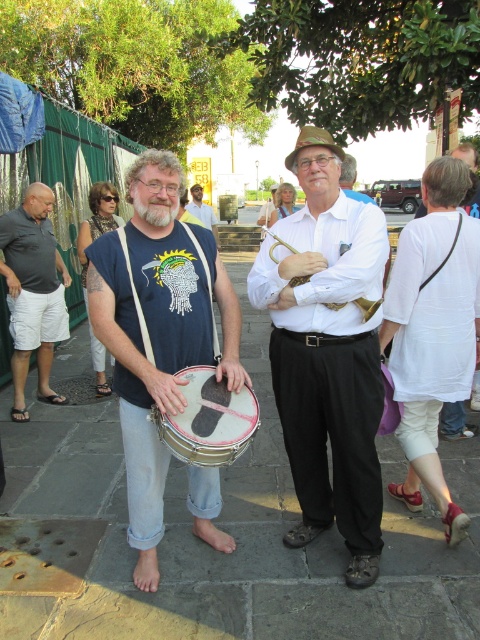
Question: Can you confirm if matte black drum at center is positioned below matte blue shirt at center?

Choices:
 (A) no
 (B) yes

Answer: (B)

Question: Which point is closer to the camera taking this photo?

Choices:
 (A) (271, 230)
 (B) (199, 392)
 (C) (250, 326)
 (D) (291, 328)

Answer: (B)

Question: Which point is closer to the camera?

Choices:
 (A) matte black t-shirt at center
 (B) gray stone pavement at center
 (C) matte black drum at center

Answer: (C)

Question: Which object is closer to the camera taking this photo?

Choices:
 (A) matte black drum at center
 (B) gray stone pavement at center
 (C) matte black t-shirt at center
 (D) gold brass trumpet at center

Answer: (A)

Question: Does gray stone pavement at center come in front of white cotton shirt at center?

Choices:
 (A) no
 (B) yes

Answer: (B)

Question: Does matte black t-shirt at center come in front of matte white shirt at center?

Choices:
 (A) yes
 (B) no

Answer: (B)